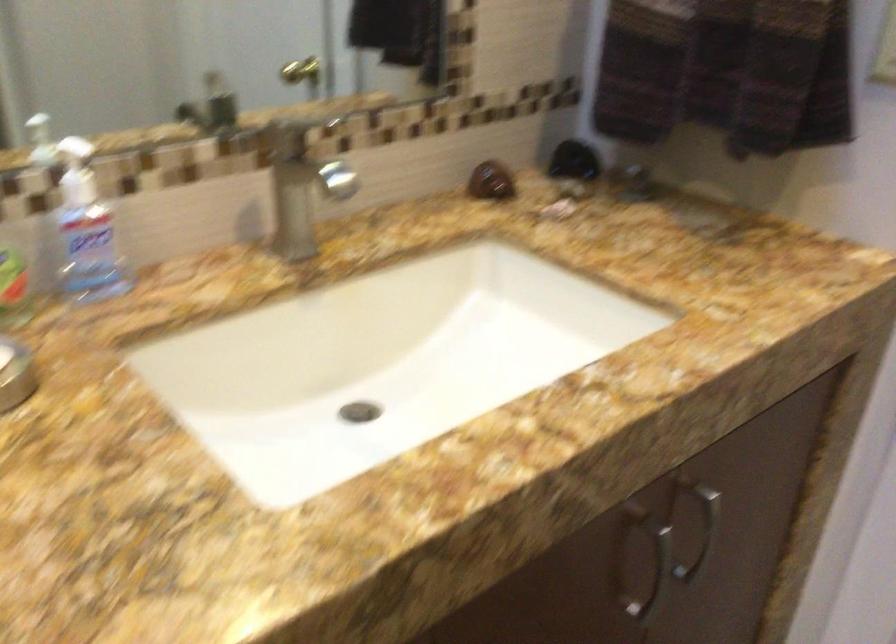
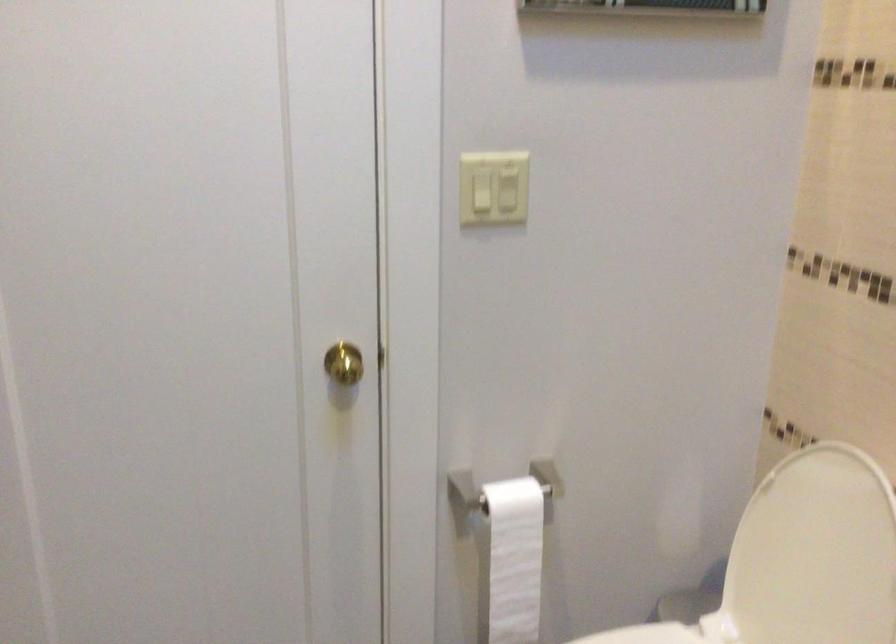
How did the camera likely rotate?

The rotation direction of the camera is left-down.